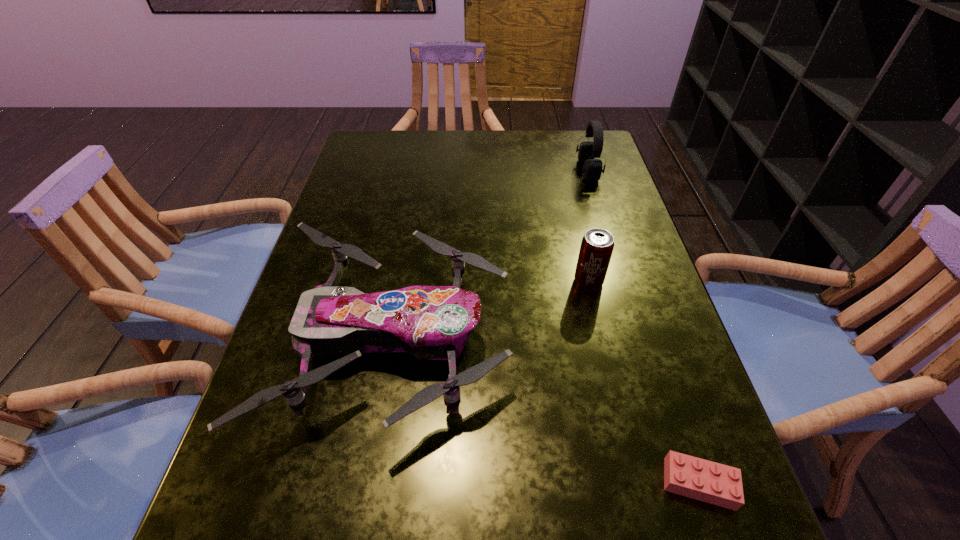
I want to click on object that stands as the closest to the farthest object, so click(x=597, y=245).

Find the location of a particular element. the second closest object to the leftmost object is located at coordinates (696, 478).